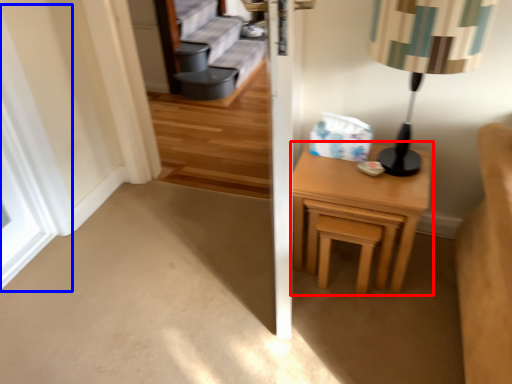
Question: Which of the following is the closest to the observer, nightstand (highlighted by a red box) or window (highlighted by a blue box)?

Choices:
 (A) nightstand
 (B) window

Answer: (A)